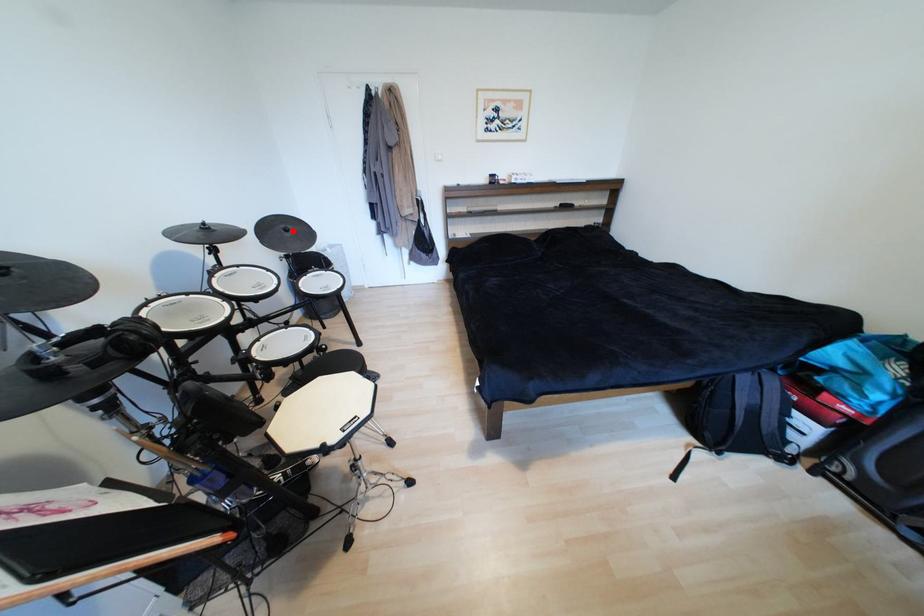
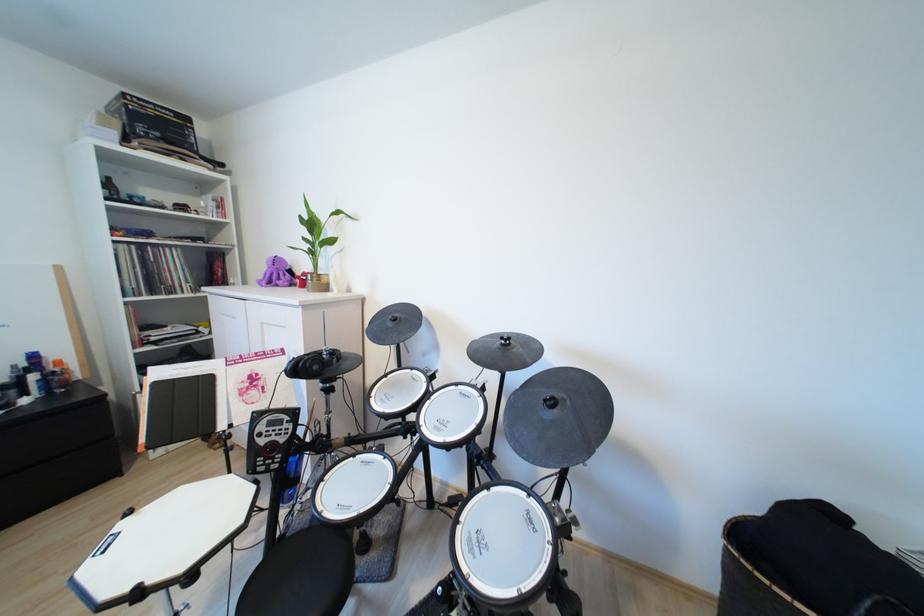
The point at the highlighted location is marked in the first image. Where is the corresponding point in the second image?

(560, 405)